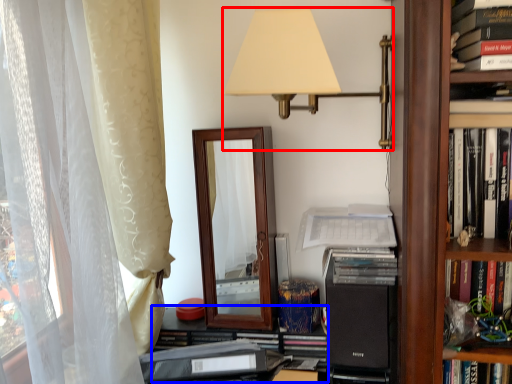
Question: Which point is further to the camera, lamp (highlighted by a red box) or shelf (highlighted by a blue box)?

Choices:
 (A) lamp
 (B) shelf

Answer: (B)